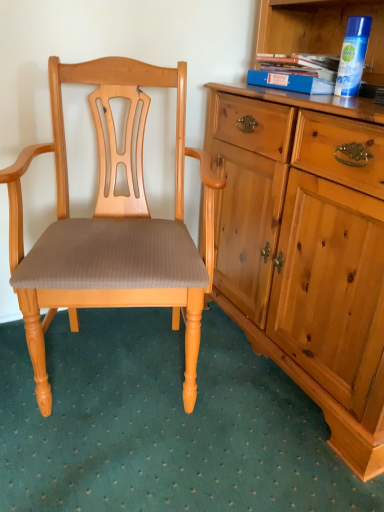
Image resolution: width=384 pixels, height=512 pixels. I want to click on free space below matte wood chair at center (from a real-world perspective), so click(113, 387).